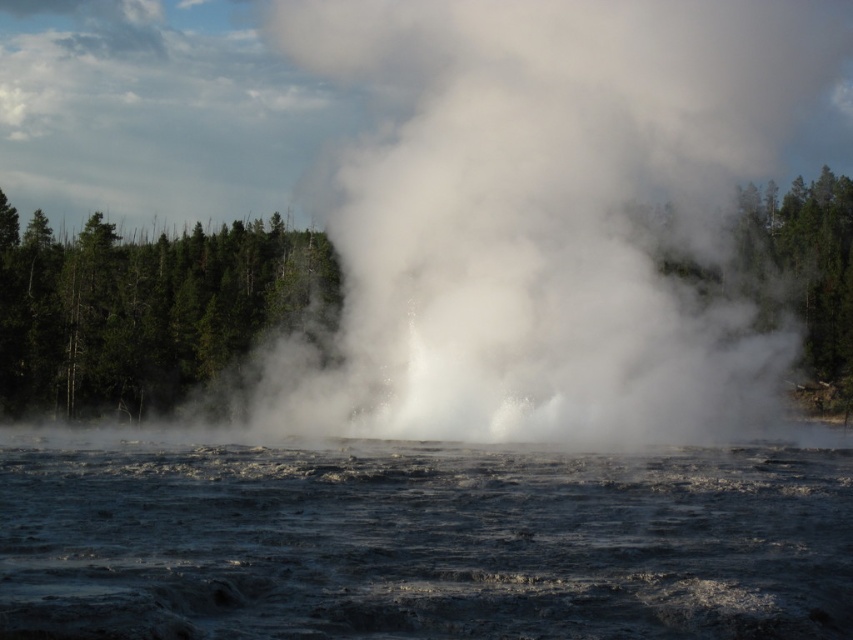
Question: Does translucent dark water at center come in front of green matte tree at left?

Choices:
 (A) yes
 (B) no

Answer: (A)

Question: Is white vapor at center to the left of green matte tree at left from the viewer's perspective?

Choices:
 (A) no
 (B) yes

Answer: (A)

Question: Does translucent dark water at center have a greater width compared to green matte tree at left?

Choices:
 (A) no
 (B) yes

Answer: (A)

Question: Which object is positioned closest to the white vapor at center?

Choices:
 (A) green matte tree at left
 (B) translucent dark water at center

Answer: (A)

Question: Which point appears closest to the camera in this image?

Choices:
 (A) (561, 364)
 (B) (567, 476)

Answer: (B)

Question: Which of these objects is positioned closest to the translucent dark water at center?

Choices:
 (A) green matte tree at left
 (B) white vapor at center

Answer: (B)